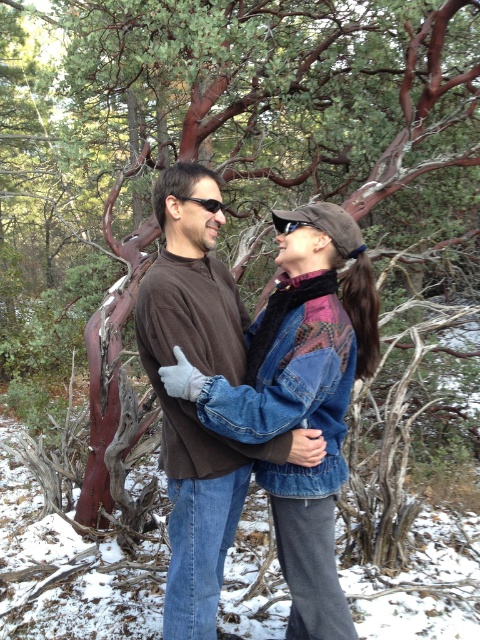
You are a photographer trying to capture a closeup shot of the clear plastic goggles at upper center while ensuring the brown sweater at center is still visible in the frame. Can you fit both in the shot if your camera has a 120mm lens?

The brown sweater at center is larger in size than clear plastic goggles at upper center. Since the sweater is bigger, using a 120mm lens should allow both to be visible as the sweater takes up more space but the goggles are smaller and can fit within the frame along with the sweater.

You are standing at the origin of the coordinate system in the image. There is a point at coordinates point (192, 403). What object is located at that point?

The point at coordinates (192, 403) corresponds to the brown sweater at center.